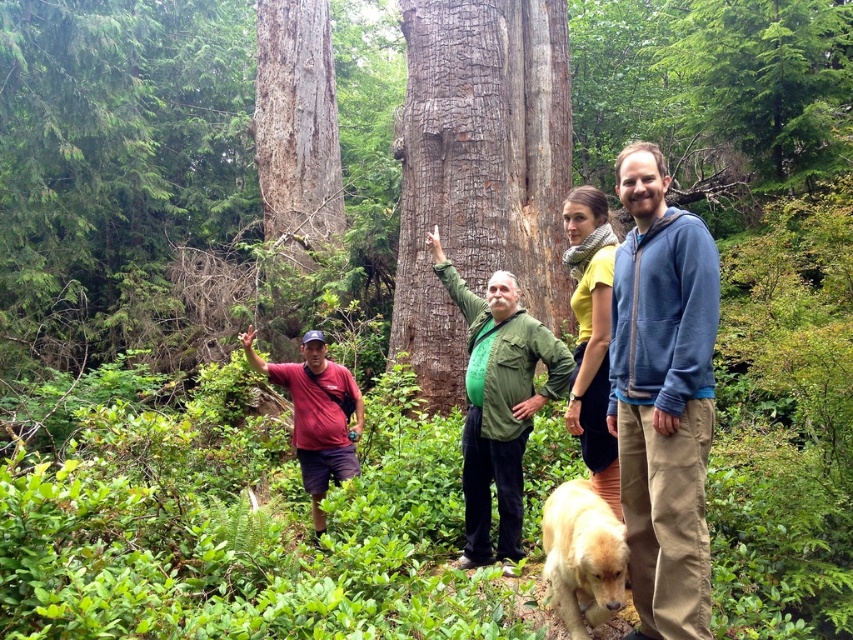
Based on the coordinates provided, where is the blue fleece jacket at right located in the image?

The blue fleece jacket at right is located at the coordinates point (663,397).

Looking at this image, you are a photographer standing in the forest scene. You need to capture a photo where both the blue fleece jacket at right and the golden fur dog at lower center are visible. Considering their sizes, which object should you frame closer to the center to ensure both fit in the shot?

The blue fleece jacket at right is wider than the golden fur dog at lower center. To ensure both fit in the shot, frame the blue fleece jacket at right closer to the center since it is larger.

You are a photographer standing in the forest scene. You want to take a photo that includes both the blue fleece jacket at right and the yellow matte scarf at upper center. Which object should you focus on first to ensure both are in the frame?

The blue fleece jacket at right is positioned under the yellow matte scarf at upper center, so you should focus on the yellow matte scarf at upper center first to ensure both are in the frame.